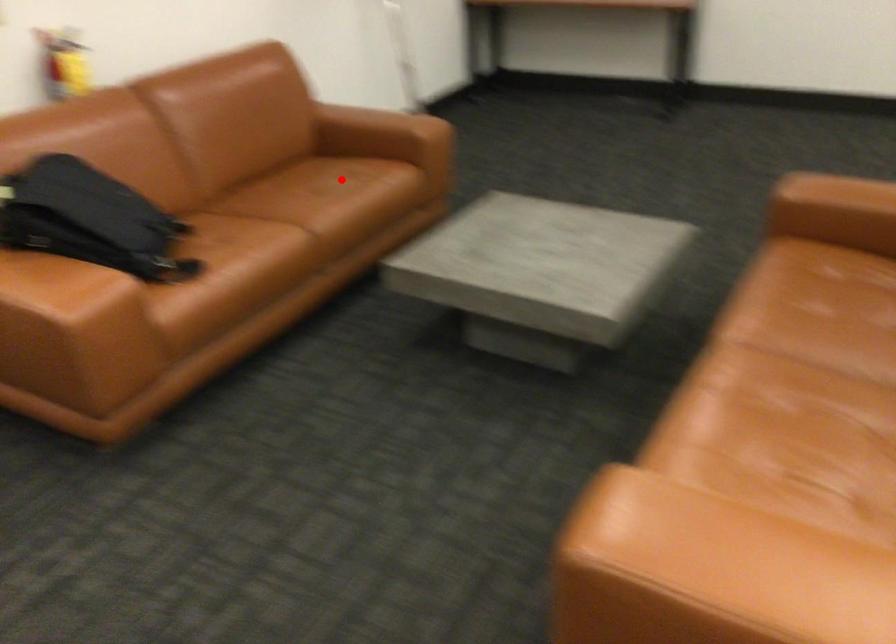
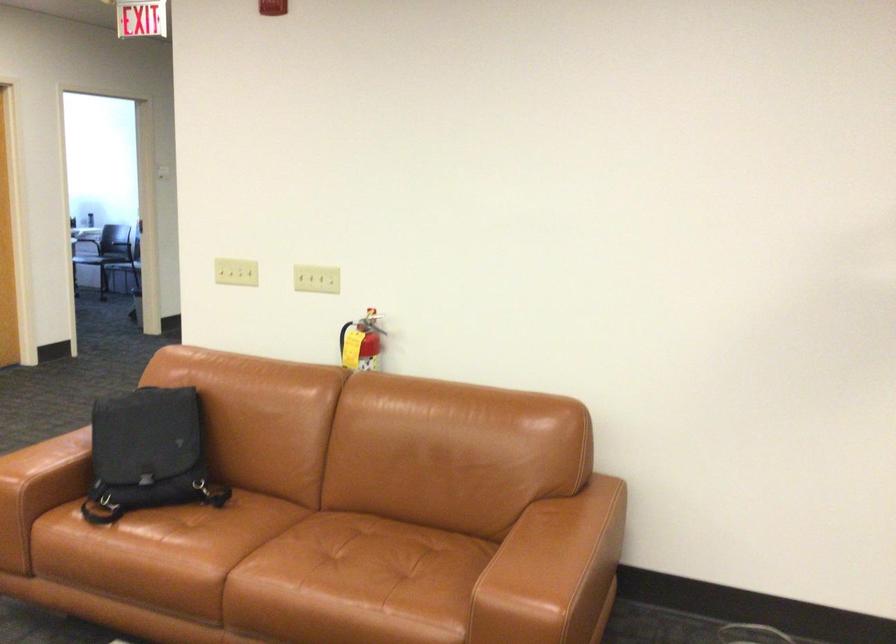
Where in the second image is the point corresponding to the highlighted location from the first image?

(350, 574)